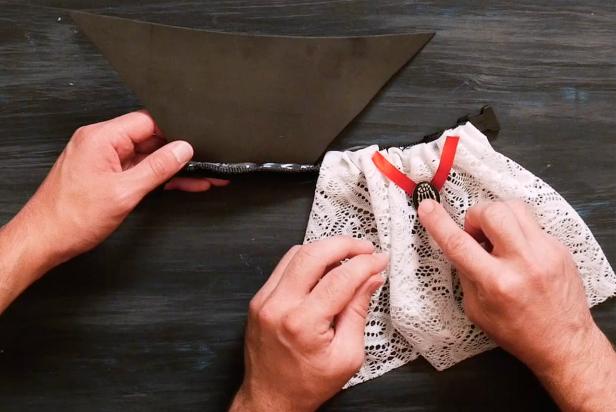
What are the coordinates of `lace` in the screenshot? It's located at (419, 311).